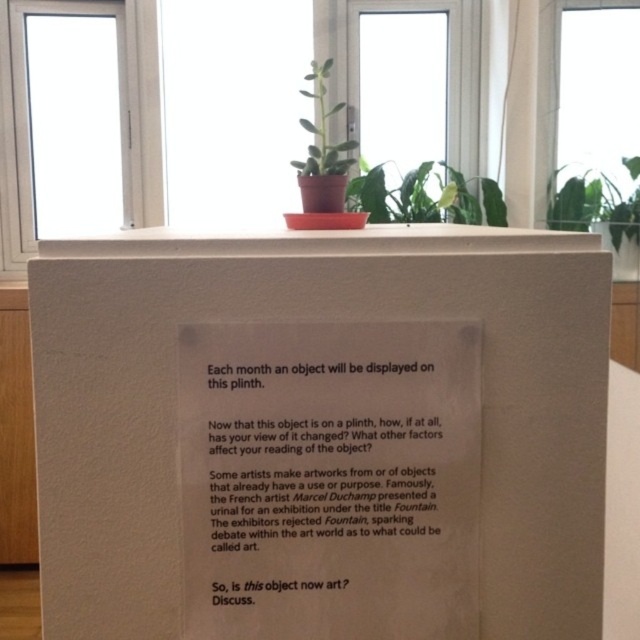
Question: Which of the following is the closest to the observer?

Choices:
 (A) (602, 148)
 (B) (374, 454)
 (C) (134, 172)

Answer: (B)

Question: Can you confirm if transparent glass window at upper center is bigger than white glass window at upper left?

Choices:
 (A) no
 (B) yes

Answer: (A)

Question: Is white matte paper at center closer to the viewer compared to white paper at center?

Choices:
 (A) no
 (B) yes

Answer: (B)

Question: Which point is farther from the camera taking this photo?

Choices:
 (A) (4, 204)
 (B) (637, 20)
 (C) (611, 243)
 (D) (307, 131)

Answer: (A)

Question: Can you confirm if white paper at center is positioned to the right of white glass window at upper left?

Choices:
 (A) no
 (B) yes

Answer: (B)

Question: Which object is positioned closest to the white glass window at upper left?

Choices:
 (A) white paper at center
 (B) white matte paper at center
 (C) transparent glass window at upper center

Answer: (C)